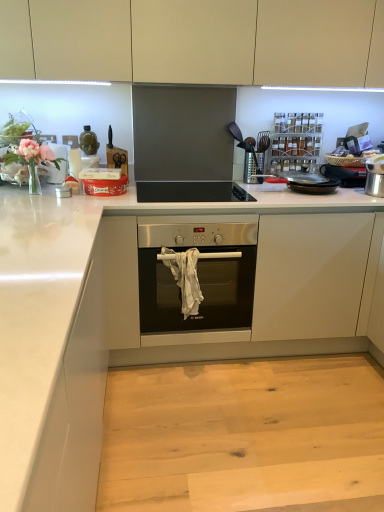
Question: Considering the relative positions of white glossy countertop at center and metallic spice rack at upper right in the image provided, is white glossy countertop at center to the left or to the right of metallic spice rack at upper right?

Choices:
 (A) right
 (B) left

Answer: (B)

Question: From a real-world perspective, is white glossy countertop at center positioned above or below metallic spice rack at upper right?

Choices:
 (A) above
 (B) below

Answer: (B)

Question: Based on their relative distances, which object is farther from the white glossy countertop at center?

Choices:
 (A) metallic spice rack at upper right
 (B) matte beige cabinets at upper center
 (C) black matte gas stove at upper center

Answer: (B)

Question: Estimate the real-world distances between objects in this image. Which object is farther from the metallic spice rack at upper right?

Choices:
 (A) white glossy countertop at center
 (B) black matte gas stove at upper center
 (C) matte beige cabinets at upper center

Answer: (A)